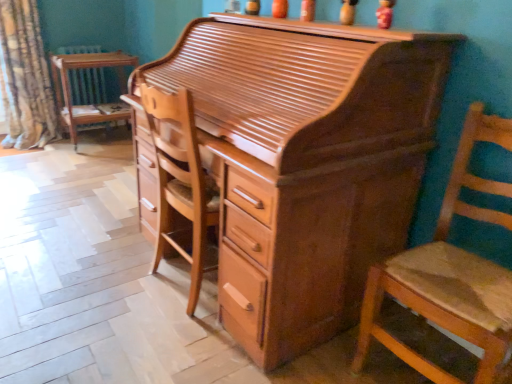
Image resolution: width=512 pixels, height=384 pixels. What do you see at coordinates (301, 162) in the screenshot? I see `shiny brown wood desk at center` at bounding box center [301, 162].

What is the approximate width of wooden chair at right?

wooden chair at right is 19.36 inches wide.

You are a GUI agent. You are given a task and a screenshot of the screen. Output one action in this format:
    pyautogui.click(x=<x>, y=<y>)
    Task: Click on the wooden radiator at left
    The height and width of the screenshot is (384, 512).
    Given the screenshot: What is the action you would take?
    pyautogui.click(x=87, y=86)

Between point (71, 106) and point (73, 52), which one is positioned in front?

Point (73, 52)

Can you confirm if wooden chair at left is bigger than wooden radiator at left?

Correct, wooden chair at left is larger in size than wooden radiator at left.

Identify the location of table below the wooden radiator at left (from a real-world perspective). (88, 89).

Which of these two, shiny brown wood desk at center or wooden chair at left, stands shorter?

wooden chair at left.

What's the angular difference between shiny brown wood desk at center and wooden chair at left's facing directions?

shiny brown wood desk at center and wooden chair at left are facing 90.6 degrees away from each other.

Is shiny brown wood desk at center not near wooden chair at left?

Yes, shiny brown wood desk at center and wooden chair at left are quite far apart.

Looking at this image, considering the sizes of shiny brown wood desk at center and wooden chair at left in the image, is shiny brown wood desk at center bigger or smaller than wooden chair at left?

Clearly, shiny brown wood desk at center is larger in size than wooden chair at left.

Is wooden chair at left directly adjacent to wooden chair at right?

wooden chair at left is not next to wooden chair at right, and they're not touching.

Would you say wooden chair at left is inside or outside wooden chair at right?

wooden chair at left lies outside wooden chair at right.

Between wooden chair at left and wooden chair at right, which one appears on the right side from the viewer's perspective?

From the viewer's perspective, wooden chair at right appears more on the right side.

Is wooden radiator at left not near wooden chair at left?

No, wooden radiator at left is not far from wooden chair at left.

Does wooden radiator at left have a larger size compared to wooden chair at left?

Actually, wooden radiator at left might be smaller than wooden chair at left.

Which of these two, wooden radiator at left or wooden chair at left, stands shorter?

wooden chair at left is shorter.

Considering the sizes of objects wooden radiator at left and wooden chair at left in the image provided, who is thinner, wooden radiator at left or wooden chair at left?

Thinner between the two is wooden radiator at left.

From a real-world perspective, is wooden chair at left positioned over patterned fabric curtain at left based on gravity?

Actually, wooden chair at left is physically below patterned fabric curtain at left in the real world.

Is patterned fabric curtain at left at the back of wooden chair at left?

No, wooden chair at left is not facing away from patterned fabric curtain at left.

What are the coordinates of `table that is below the patterned fabric curtain at left (from the image's perspective)` in the screenshot? It's located at (88, 89).

Is wooden chair at left not near patterned fabric curtain at left?

No, there isn't a large distance between wooden chair at left and patterned fabric curtain at left.

Is point (488, 300) positioned in front of point (88, 88)?

Yes.

Considering the positions of objects wooden chair at right and wooden radiator at left in the image provided, who is more to the right, wooden chair at right or wooden radiator at left?

wooden chair at right is more to the right.

Is wooden chair at right facing away from wooden radiator at left?

No.

Considering the points (326, 38) and (93, 103), which point is behind, point (326, 38) or point (93, 103)?

Positioned behind is point (93, 103).

From a real-world perspective, is shiny brown wood desk at center beneath wooden radiator at left?

No, from a real-world perspective, shiny brown wood desk at center is not below wooden radiator at left.

In the scene shown: Considering the relative positions of shiny brown wood desk at center and wooden radiator at left in the image provided, is shiny brown wood desk at center to the left of wooden radiator at left from the viewer's perspective?

Incorrect, shiny brown wood desk at center is not on the left side of wooden radiator at left.

Is shiny brown wood desk at center located outside wooden radiator at left?

Yes, shiny brown wood desk at center is outside of wooden radiator at left.

This screenshot has height=384, width=512. What are the coordinates of `radiator on the left side of wooden chair at left` in the screenshot? It's located at (87, 86).

The width and height of the screenshot is (512, 384). Identify the location of chest of drawers above the wooden chair at left (from a real-world perspective). (301, 162).

Looking at the image, which one is located further to wooden radiator at left, shiny brown wood desk at center or wooden chair at left?

shiny brown wood desk at center lies further to wooden radiator at left than the other object.

Estimate the real-world distances between objects in this image. Which object is further from wooden chair at left, patterned fabric curtain at left or wooden chair at right?

Based on the image, wooden chair at right appears to be further to wooden chair at left.

Which object lies further to the anchor point shiny brown wood desk at center, patterned fabric curtain at left or wooden radiator at left?

wooden radiator at left is further to shiny brown wood desk at center.

Which object lies further to the anchor point wooden chair at right, shiny brown wood desk at center or patterned fabric curtain at left?

patterned fabric curtain at left is positioned further to the anchor wooden chair at right.

From the image, which object appears to be farther from wooden radiator at left, wooden chair at left or patterned fabric curtain at left?

patterned fabric curtain at left is further to wooden radiator at left.

From the image, which object appears to be farther from patterned fabric curtain at left, shiny brown wood desk at center or wooden radiator at left?

The object further to patterned fabric curtain at left is shiny brown wood desk at center.

In the scene shown: Considering their positions, is patterned fabric curtain at left positioned closer to shiny brown wood desk at center than wooden chair at right?

The object closer to shiny brown wood desk at center is wooden chair at right.

Considering their positions, is shiny brown wood desk at center positioned closer to patterned fabric curtain at left than wooden chair at left?

wooden chair at left is positioned closer to the anchor patterned fabric curtain at left.

This screenshot has width=512, height=384. In order to click on table located between patterned fabric curtain at left and wooden radiator at left in the depth direction in this screenshot , I will do `click(88, 89)`.

This screenshot has height=384, width=512. I want to click on curtain between shiny brown wood desk at center and wooden chair at left along the z-axis, so click(x=25, y=78).

This screenshot has width=512, height=384. In order to click on chest of drawers between wooden chair at right and wooden chair at left from front to back in this screenshot , I will do `click(301, 162)`.

Image resolution: width=512 pixels, height=384 pixels. I want to click on chest of drawers between patterned fabric curtain at left and wooden chair at right in the horizontal direction, so click(301, 162).